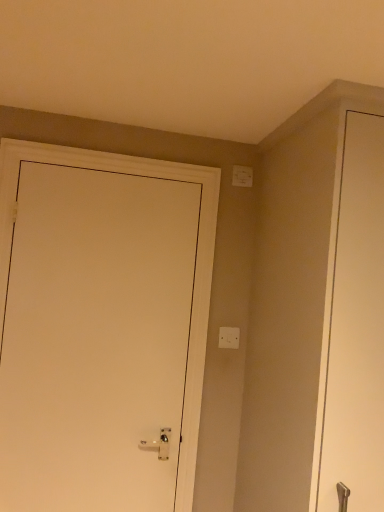
Question: Considering the relative sizes of white matte door at left and white plastic light switch at center, positioned as the second light switch in top-to-bottom order, in the image provided, is white matte door at left smaller than white plastic light switch at center, positioned as the second light switch in top-to-bottom order,?

Choices:
 (A) no
 (B) yes

Answer: (A)

Question: Is white matte door at left wider than white plastic light switch at center, positioned as the second light switch in top-to-bottom order?

Choices:
 (A) yes
 (B) no

Answer: (A)

Question: From a real-world perspective, is white matte door at left physically below white plastic light switch at center, positioned as the second light switch in top-to-bottom order?

Choices:
 (A) no
 (B) yes

Answer: (B)

Question: From the image's perspective, would you say white matte door at left is shown under white plastic light switch at center, marked as the first light switch in a bottom-to-top arrangement?

Choices:
 (A) yes
 (B) no

Answer: (B)

Question: Is white matte door at left further to the viewer compared to white plastic light switch at center, marked as the first light switch in a bottom-to-top arrangement?

Choices:
 (A) no
 (B) yes

Answer: (A)

Question: Could you tell me if white matte door at left is turned towards white plastic light switch at center, positioned as the second light switch in top-to-bottom order?

Choices:
 (A) no
 (B) yes

Answer: (A)

Question: Is white plastic light switch at center, positioned as the second light switch in top-to-bottom order, thinner than white matte door at left?

Choices:
 (A) no
 (B) yes

Answer: (B)

Question: Is white plastic light switch at center, marked as the first light switch in a bottom-to-top arrangement, far from white matte door at left?

Choices:
 (A) yes
 (B) no

Answer: (B)

Question: Is white plastic light switch at center, positioned as the second light switch in top-to-bottom order, closer to the viewer compared to white matte door at left?

Choices:
 (A) yes
 (B) no

Answer: (B)

Question: Considering the relative positions of white plastic light switch at center, positioned as the second light switch in top-to-bottom order, and white matte door at left in the image provided, is white plastic light switch at center, positioned as the second light switch in top-to-bottom order, to the left of white matte door at left from the viewer's perspective?

Choices:
 (A) no
 (B) yes

Answer: (A)

Question: Is white plastic light switch at center, positioned as the second light switch in top-to-bottom order, outside of white matte door at left?

Choices:
 (A) yes
 (B) no

Answer: (A)

Question: From a real-world perspective, does white plastic light switch at center, marked as the first light switch in a bottom-to-top arrangement, sit lower than white matte door at left?

Choices:
 (A) no
 (B) yes

Answer: (A)

Question: Does white matte door at left come in front of white plastic light switch at upper right, positioned as the second light switch in bottom-to-top order?

Choices:
 (A) yes
 (B) no

Answer: (A)